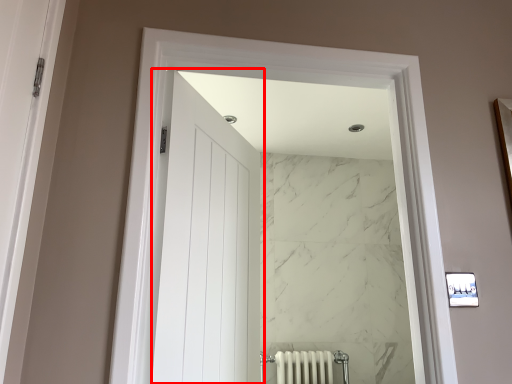
Question: From the image's perspective, considering the relative positions of door (annotated by the red box) and window in the image provided, where is door (annotated by the red box) located with respect to the staircase?

Choices:
 (A) above
 (B) below

Answer: (B)